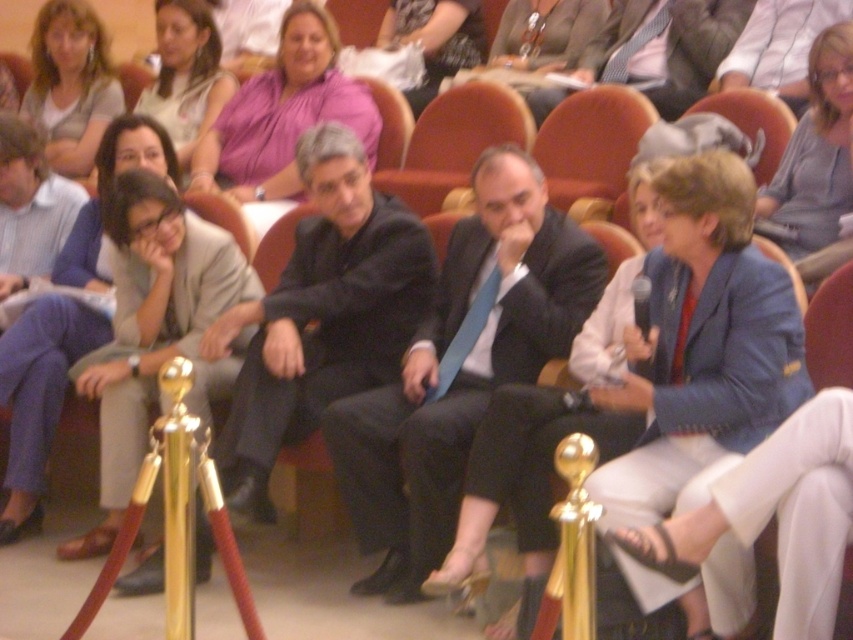
Is black suit at center to the right of matte gray blouse at upper left from the viewer's perspective?

Correct, you'll find black suit at center to the right of matte gray blouse at upper left.

Who is taller, black suit at center or matte gray blouse at upper left?

black suit at center

Between point (440, 385) and point (33, 72), which one is positioned in front?

Point (440, 385) is in front.

The height and width of the screenshot is (640, 853). What are the coordinates of `black suit at center` in the screenshot? It's located at (460, 369).

Is black matte suit at center positioned before purple satin blouse at upper center?

Yes, black matte suit at center is closer to the viewer.

Does black matte suit at center have a larger size compared to purple satin blouse at upper center?

Yes.

Is point (236, 440) positioned behind point (229, 129)?

No, (236, 440) is closer to viewer.

Where is `black matte suit at center`? This screenshot has width=853, height=640. black matte suit at center is located at coordinates (325, 314).

Is purple satin blouse at upper center in front of matte pink blouse at upper left?

Yes, purple satin blouse at upper center is closer to the viewer.

Can you confirm if purple satin blouse at upper center is positioned to the right of matte pink blouse at upper left?

Indeed, purple satin blouse at upper center is positioned on the right side of matte pink blouse at upper left.

Is point (347, 120) positioned after point (177, 52)?

No, it is in front of (177, 52).

The width and height of the screenshot is (853, 640). In order to click on purple satin blouse at upper center in this screenshot , I will do `click(283, 113)`.